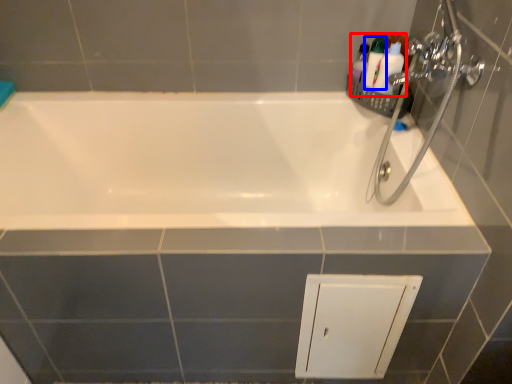
Question: Which object is closer to the camera taking this photo, toiletry (highlighted by a red box) or toiletry (highlighted by a blue box)?

Choices:
 (A) toiletry
 (B) toiletry

Answer: (A)